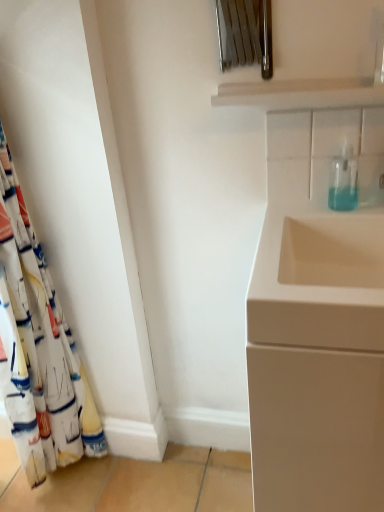
At what (x,y) coordinates should I click in order to perform the action: click on free space to the left of transparent plastic soap dispenser at upper right. Please return your answer as a coordinate pair (x, y). Looking at the image, I should click on (300, 207).